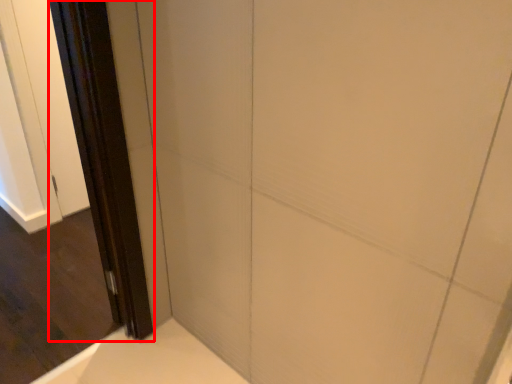
Question: Observing the image, what is the correct spatial positioning of screen door (annotated by the red box) in reference to screen door?

Choices:
 (A) left
 (B) right

Answer: (B)